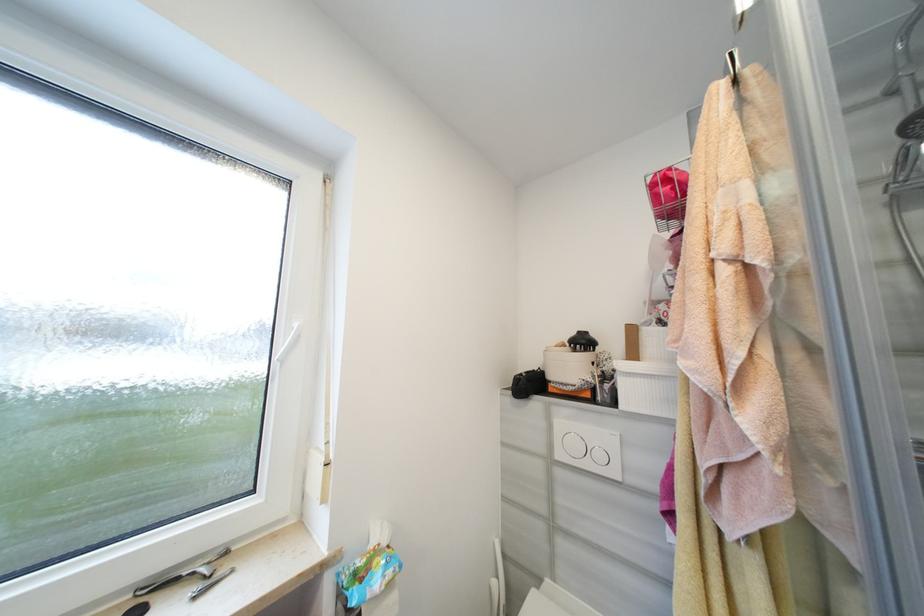
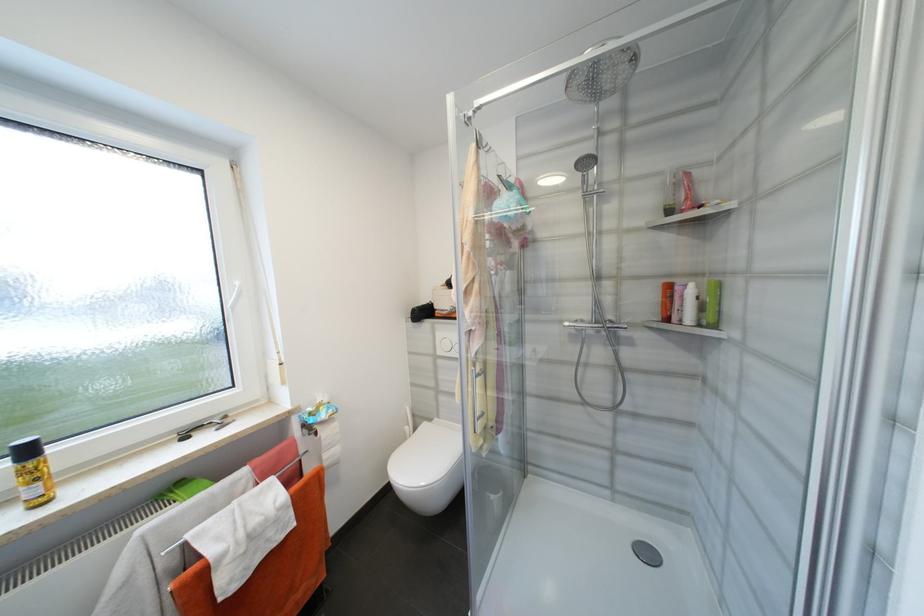
The point at (548, 451) is marked in the first image. Where is the corresponding point in the second image?

(436, 352)